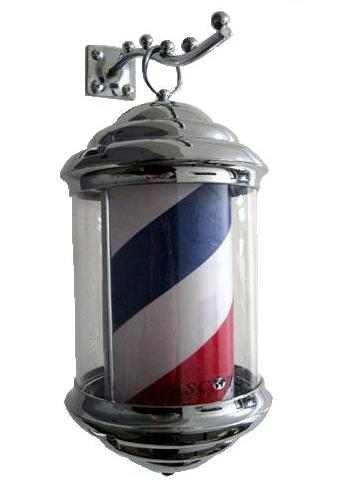
Find the location of `glass case`. glass case is located at coordinates (247, 334).